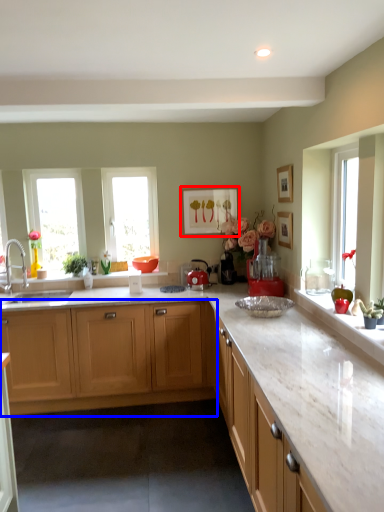
Question: Which object is closer to the camera taking this photo, picture frame (highlighted by a red box) or cabinetry (highlighted by a blue box)?

Choices:
 (A) picture frame
 (B) cabinetry

Answer: (B)